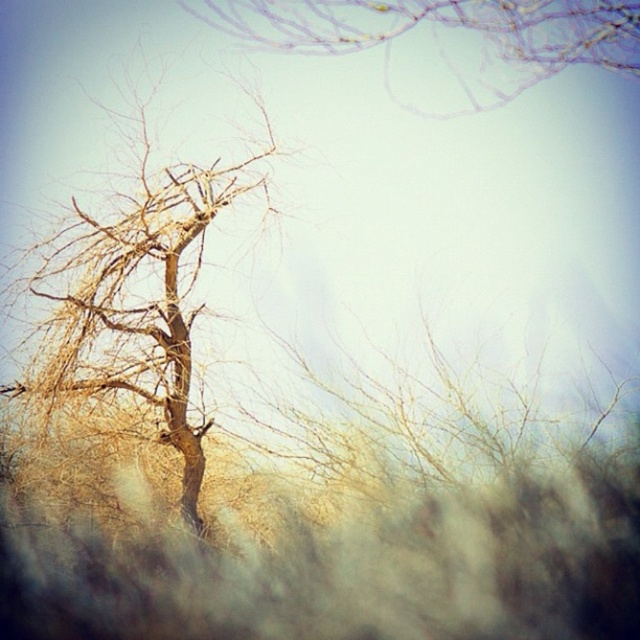
Question: Among these objects, which one is nearest to the camera?

Choices:
 (A) bare wood tree at left
 (B) bare branches at upper center

Answer: (A)

Question: Which point is closer to the camera taking this photo?

Choices:
 (A) (266, 35)
 (B) (49, 244)

Answer: (B)

Question: Can you confirm if bare wood tree at left is positioned above bare branches at upper center?

Choices:
 (A) no
 (B) yes

Answer: (A)

Question: Is bare wood tree at left smaller than bare branches at upper center?

Choices:
 (A) yes
 (B) no

Answer: (B)

Question: Can you confirm if bare wood tree at left is positioned above bare branches at upper center?

Choices:
 (A) yes
 (B) no

Answer: (B)